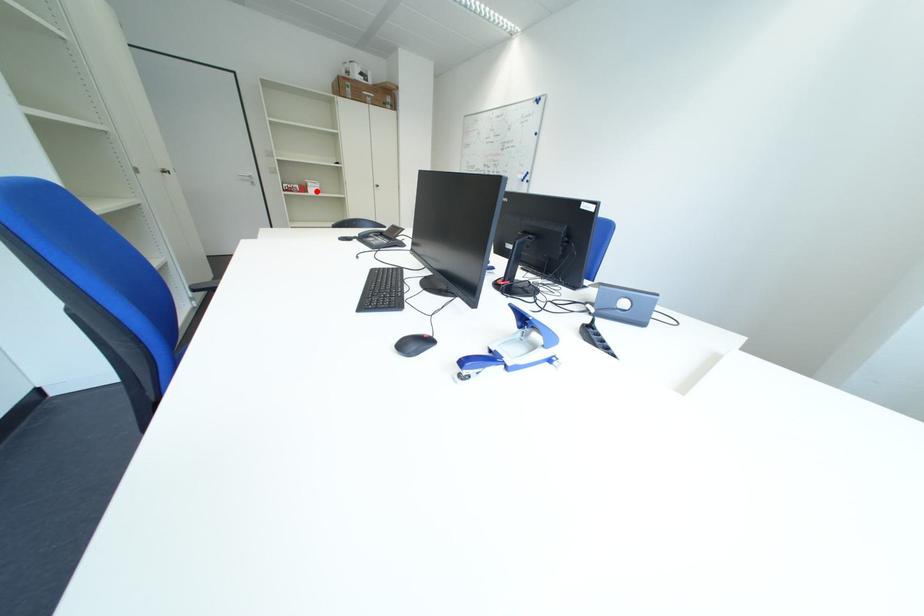
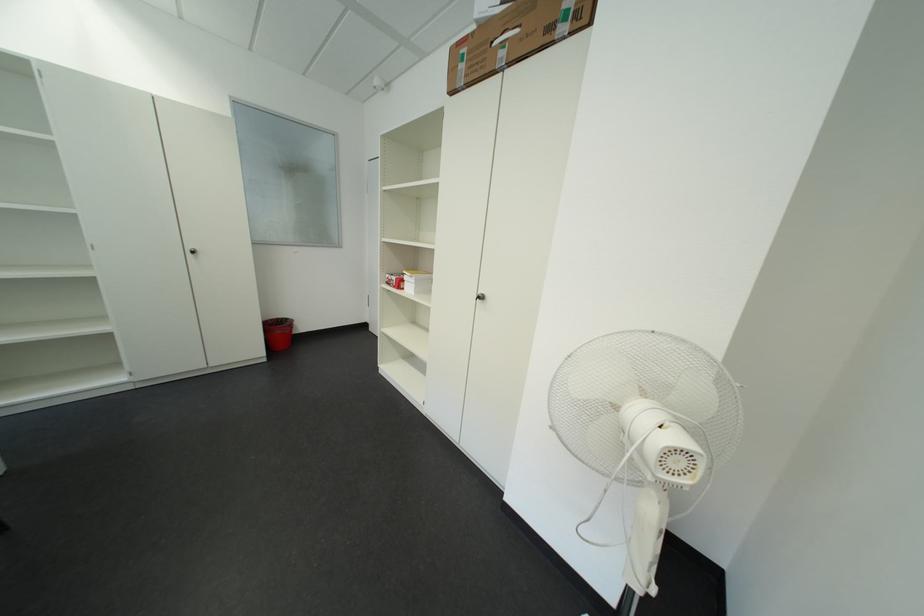
In the second image, find the point that corresponds to the highlighted location in the first image.

(411, 286)